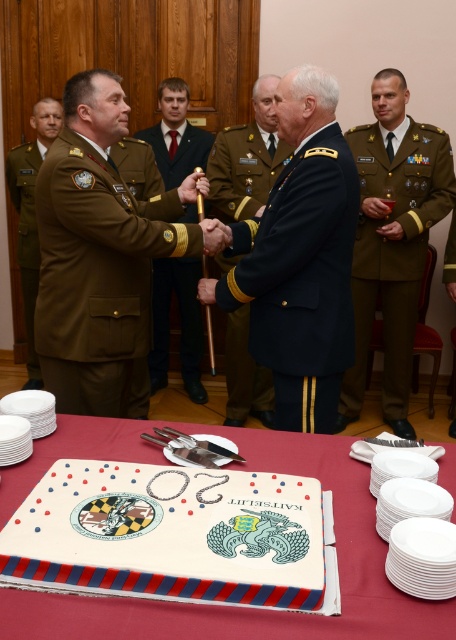
You are attending a military ceremony and notice two uniforms displayed on a table. The dark blue fabric uniform at center and the green fabric uniform at right. Which uniform is positioned lower on the table?

The dark blue fabric uniform at center is located below the green fabric uniform at right, so it is positioned lower on the table.